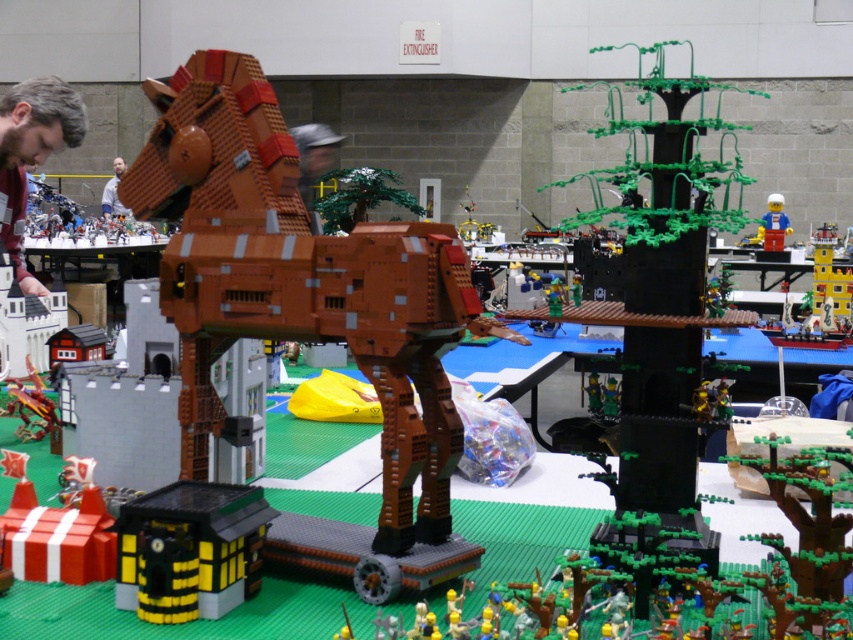
Which of these two, brown matte horse at center or brown hair at upper left, stands shorter?

Standing shorter between the two is brown hair at upper left.

Does brown matte horse at center have a lesser height compared to brown hair at upper left?

Incorrect, brown matte horse at center's height does not fall short of brown hair at upper left's.

Where is `brown matte horse at center`? The width and height of the screenshot is (853, 640). brown matte horse at center is located at coordinates click(x=306, y=310).

What do you see at coordinates (306, 310) in the screenshot? This screenshot has height=640, width=853. I see `brown matte horse at center` at bounding box center [306, 310].

Does brown matte horse at center appear on the left side of blue plastic minifigure at center?

Indeed, brown matte horse at center is positioned on the left side of blue plastic minifigure at center.

Does point (209, 396) lie in front of point (781, 224)?

That is True.

Where is `brown matte horse at center`? Image resolution: width=853 pixels, height=640 pixels. brown matte horse at center is located at coordinates (306, 310).

Is brown hair at upper left in front of blue plastic minifigure at center?

Yes, brown hair at upper left is closer to the viewer.

Who is taller, brown hair at upper left or blue plastic minifigure at center?

blue plastic minifigure at center is taller.

You are a GUI agent. You are given a task and a screenshot of the screen. Output one action in this format:
    pyautogui.click(x=<x>, y=<y>)
    Task: Click on the brown hair at upper left
    
    Given the screenshot: What is the action you would take?
    pyautogui.click(x=32, y=152)

Locate an element on the screen. Image resolution: width=853 pixels, height=640 pixels. brown hair at upper left is located at coordinates (32, 152).